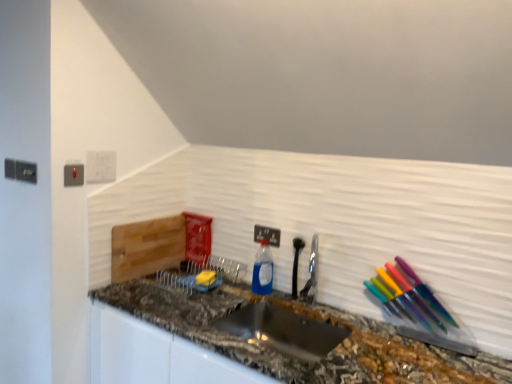
Question: From the image's perspective, would you say blue translucent bottle at center is shown under satin nickel faucet at center?

Choices:
 (A) yes
 (B) no

Answer: (B)

Question: Can you confirm if blue translucent bottle at center is taller than satin nickel faucet at center?

Choices:
 (A) yes
 (B) no

Answer: (A)

Question: Is blue translucent bottle at center behind satin nickel faucet at center?

Choices:
 (A) no
 (B) yes

Answer: (B)

Question: From the image's perspective, would you say blue translucent bottle at center is positioned over satin nickel faucet at center?

Choices:
 (A) no
 (B) yes

Answer: (B)

Question: Can you see blue translucent bottle at center touching satin nickel faucet at center?

Choices:
 (A) yes
 (B) no

Answer: (B)

Question: Looking at the image, does marble granite countertop at center seem bigger or smaller compared to stainless steel sink at center?

Choices:
 (A) big
 (B) small

Answer: (A)

Question: In the image, is marble granite countertop at center positioned in front of or behind stainless steel sink at center?

Choices:
 (A) front
 (B) behind

Answer: (A)

Question: From the image's perspective, is marble granite countertop at center located above or below stainless steel sink at center?

Choices:
 (A) above
 (B) below

Answer: (B)

Question: Which is correct: marble granite countertop at center is inside stainless steel sink at center, or outside of it?

Choices:
 (A) inside
 (B) outside

Answer: (B)

Question: From the image's perspective, relative to satin nickel faucet at center, is matte gray electric outlet at upper left, which appears as the 1th electric outlet when viewed from the left, above or below?

Choices:
 (A) above
 (B) below

Answer: (A)

Question: From a real-world perspective, relative to satin nickel faucet at center, is matte gray electric outlet at upper left, arranged as the first electric outlet when viewed from the top, vertically above or below?

Choices:
 (A) below
 (B) above

Answer: (B)

Question: Is matte gray electric outlet at upper left, which appears as the 1th electric outlet when viewed from the left, to the left or to the right of satin nickel faucet at center in the image?

Choices:
 (A) left
 (B) right

Answer: (A)

Question: In the image, is matte gray electric outlet at upper left, arranged as the first electric outlet when viewed from the front, positioned in front of or behind satin nickel faucet at center?

Choices:
 (A) behind
 (B) front

Answer: (B)

Question: From a real-world perspective, is blue translucent bottle at center physically located above or below white plastic light switch at upper left?

Choices:
 (A) below
 (B) above

Answer: (A)

Question: Is blue translucent bottle at center taller or shorter than white plastic light switch at upper left?

Choices:
 (A) tall
 (B) short

Answer: (A)